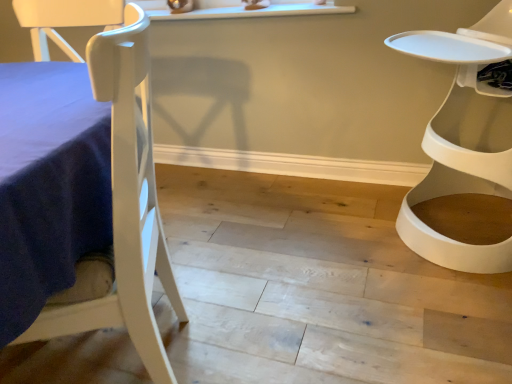
Identify the location of white matte chair at left, marked as the 1th chair in a left-to-right arrangement. pos(114,190).

What is the approximate height of white matte chair at left, marked as the 1th chair in a left-to-right arrangement?

white matte chair at left, marked as the 1th chair in a left-to-right arrangement, is 92.71 centimeters tall.

This screenshot has width=512, height=384. What do you see at coordinates (114, 190) in the screenshot?
I see `white matte chair at left, marked as the 1th chair in a left-to-right arrangement` at bounding box center [114, 190].

What is the approximate width of white matte chair at left, which is counted as the 2th chair, starting from the right?

white matte chair at left, which is counted as the 2th chair, starting from the right, is 17.45 inches in width.

The width and height of the screenshot is (512, 384). Describe the element at coordinates (465, 137) in the screenshot. I see `white plastic chair at right, which appears as the first chair when viewed from the right` at that location.

You are a GUI agent. You are given a task and a screenshot of the screen. Output one action in this format:
    pyautogui.click(x=<x>, y=<y>)
    Task: Click on the white plastic chair at right, which appears as the first chair when viewed from the right
    This screenshot has width=512, height=384.
    Given the screenshot: What is the action you would take?
    pyautogui.click(x=465, y=137)

The width and height of the screenshot is (512, 384). In order to click on white matte chair at left, marked as the 1th chair in a left-to-right arrangement in this screenshot , I will do `click(114, 190)`.

Considering the positions of objects white matte chair at left, marked as the 1th chair in a left-to-right arrangement, and white plastic chair at right, which appears as the first chair when viewed from the right, in the image provided, who is more to the right, white matte chair at left, marked as the 1th chair in a left-to-right arrangement, or white plastic chair at right, which appears as the first chair when viewed from the right,?

From the viewer's perspective, white plastic chair at right, which appears as the first chair when viewed from the right, appears more on the right side.

Does white matte chair at left, which is counted as the 2th chair, starting from the right, come in front of white plastic chair at right, which appears as the first chair when viewed from the right?

Yes, white matte chair at left, which is counted as the 2th chair, starting from the right, is closer to the camera.

Is point (128, 168) behind point (498, 7)?

No, (128, 168) is in front of (498, 7).

From the image's perspective, does white matte chair at left, which is counted as the 2th chair, starting from the right, appear higher than white plastic chair at right, the second chair in the left-to-right sequence?

Incorrect, from the image's perspective, white matte chair at left, which is counted as the 2th chair, starting from the right, is lower than white plastic chair at right, the second chair in the left-to-right sequence.

From a real-world perspective, is white matte chair at left, marked as the 1th chair in a left-to-right arrangement, positioned under white plastic chair at right, the second chair in the left-to-right sequence, based on gravity?

No, from a real-world perspective, white matte chair at left, marked as the 1th chair in a left-to-right arrangement, is not beneath white plastic chair at right, the second chair in the left-to-right sequence.

Looking at their sizes, would you say white matte chair at left, which is counted as the 2th chair, starting from the right, is wider or thinner than white plastic chair at right, which appears as the first chair when viewed from the right?

In the image, white matte chair at left, which is counted as the 2th chair, starting from the right, appears to be more narrow than white plastic chair at right, which appears as the first chair when viewed from the right.

Considering the sizes of objects white matte chair at left, marked as the 1th chair in a left-to-right arrangement, and white plastic chair at right, the second chair in the left-to-right sequence, in the image provided, who is taller, white matte chair at left, marked as the 1th chair in a left-to-right arrangement, or white plastic chair at right, the second chair in the left-to-right sequence,?

white matte chair at left, marked as the 1th chair in a left-to-right arrangement.

Considering the relative sizes of white matte chair at left, which is counted as the 2th chair, starting from the right, and white plastic chair at right, which appears as the first chair when viewed from the right, in the image provided, is white matte chair at left, which is counted as the 2th chair, starting from the right, bigger than white plastic chair at right, which appears as the first chair when viewed from the right,?

Actually, white matte chair at left, which is counted as the 2th chair, starting from the right, might be smaller than white plastic chair at right, which appears as the first chair when viewed from the right.

Is white matte chair at left, marked as the 1th chair in a left-to-right arrangement, not within white plastic chair at right, which appears as the first chair when viewed from the right?

white matte chair at left, marked as the 1th chair in a left-to-right arrangement, lies outside white plastic chair at right, which appears as the first chair when viewed from the right,'s area.

Are white matte chair at left, marked as the 1th chair in a left-to-right arrangement, and white plastic chair at right, the second chair in the left-to-right sequence, making contact?

No, white matte chair at left, marked as the 1th chair in a left-to-right arrangement, is not next to white plastic chair at right, the second chair in the left-to-right sequence.

Is white matte chair at left, which is counted as the 2th chair, starting from the right, aimed at white plastic chair at right, which appears as the first chair when viewed from the right?

No, white matte chair at left, which is counted as the 2th chair, starting from the right, does not turn towards white plastic chair at right, which appears as the first chair when viewed from the right.

Identify the location of chair that is under the white matte chair at left, which is counted as the 2th chair, starting from the right (from a real-world perspective). This screenshot has height=384, width=512. (465, 137).

Is white plastic chair at right, which appears as the first chair when viewed from the right, to the left of white matte chair at left, which is counted as the 2th chair, starting from the right, from the viewer's perspective?

No.

Is the position of white plastic chair at right, the second chair in the left-to-right sequence, more distant than that of white matte chair at left, marked as the 1th chair in a left-to-right arrangement?

Yes, it is behind white matte chair at left, marked as the 1th chair in a left-to-right arrangement.

Does point (508, 107) appear closer or farther from the camera than point (117, 303)?

Point (508, 107) is positioned farther from the camera compared to point (117, 303).

From the image's perspective, which object appears higher, white plastic chair at right, which appears as the first chair when viewed from the right, or white matte chair at left, which is counted as the 2th chair, starting from the right?

From the image's view, white plastic chair at right, which appears as the first chair when viewed from the right, is above.

From a real-world perspective, which object stands above the other?

white matte chair at left, which is counted as the 2th chair, starting from the right, from a real-world perspective.

Is white plastic chair at right, which appears as the first chair when viewed from the right, wider or thinner than white matte chair at left, marked as the 1th chair in a left-to-right arrangement?

Clearly, white plastic chair at right, which appears as the first chair when viewed from the right, has more width compared to white matte chair at left, marked as the 1th chair in a left-to-right arrangement.

Which of these two, white plastic chair at right, which appears as the first chair when viewed from the right, or white matte chair at left, which is counted as the 2th chair, starting from the right, stands shorter?

white plastic chair at right, which appears as the first chair when viewed from the right.

Is white plastic chair at right, the second chair in the left-to-right sequence, bigger or smaller than white matte chair at left, which is counted as the 2th chair, starting from the right?

Considering their sizes, white plastic chair at right, the second chair in the left-to-right sequence, takes up more space than white matte chair at left, which is counted as the 2th chair, starting from the right.

Is white plastic chair at right, the second chair in the left-to-right sequence, positioned beyond the bounds of white matte chair at left, marked as the 1th chair in a left-to-right arrangement?

Absolutely, white plastic chair at right, the second chair in the left-to-right sequence, is external to white matte chair at left, marked as the 1th chair in a left-to-right arrangement.

Would you say white plastic chair at right, which appears as the first chair when viewed from the right, is a long distance from white matte chair at left, marked as the 1th chair in a left-to-right arrangement?

Yes, white plastic chair at right, which appears as the first chair when viewed from the right, is far from white matte chair at left, marked as the 1th chair in a left-to-right arrangement.

Is white plastic chair at right, which appears as the first chair when viewed from the right, facing away from white matte chair at left, which is counted as the 2th chair, starting from the right?

No, white plastic chair at right, which appears as the first chair when viewed from the right, is not facing the opposite direction of white matte chair at left, which is counted as the 2th chair, starting from the right.

Can you tell me how much white plastic chair at right, the second chair in the left-to-right sequence, and white matte chair at left, marked as the 1th chair in a left-to-right arrangement, differ in facing direction?

The angular difference between white plastic chair at right, the second chair in the left-to-right sequence, and white matte chair at left, marked as the 1th chair in a left-to-right arrangement, is 69.2 degrees.

Find the location of `chair lying on the right of white matte chair at left, marked as the 1th chair in a left-to-right arrangement`. chair lying on the right of white matte chair at left, marked as the 1th chair in a left-to-right arrangement is located at coordinates (465, 137).

Identify the location of chair that is in front of the white plastic chair at right, which appears as the first chair when viewed from the right. This screenshot has width=512, height=384. (114, 190).

Locate an element on the screen. chair below the white plastic chair at right, which appears as the first chair when viewed from the right (from the image's perspective) is located at coordinates (114, 190).